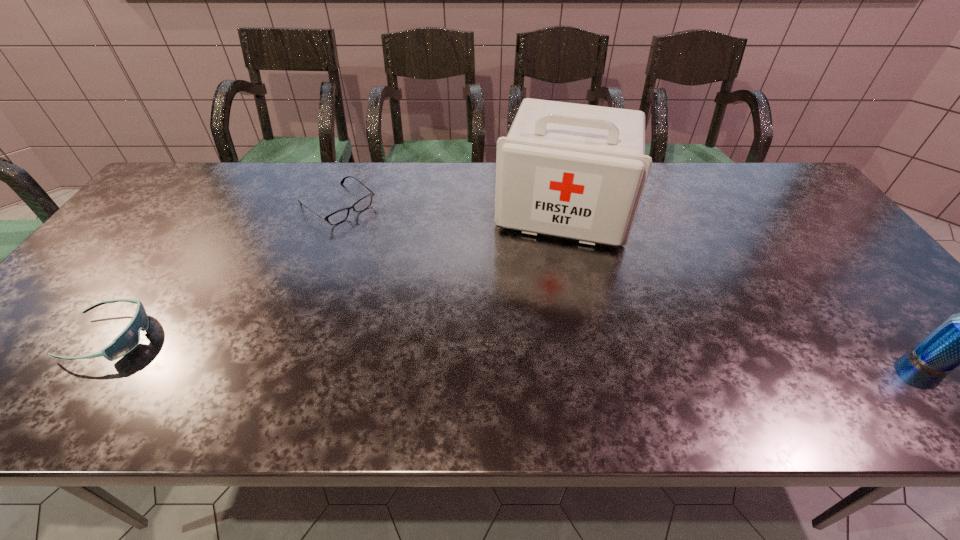
Where is `the closest object to the third object from right to left`? the closest object to the third object from right to left is located at coordinates (577, 171).

The image size is (960, 540). Find the location of `vacant point that satisfies the following two spatial constraints: 1. on the front side of the first-aid kit; 2. on the right side of the spectacles`. vacant point that satisfies the following two spatial constraints: 1. on the front side of the first-aid kit; 2. on the right side of the spectacles is located at coordinates (336, 210).

You are a GUI agent. You are given a task and a screenshot of the screen. Output one action in this format:
    pyautogui.click(x=<x>, y=<y>)
    Task: Click on the free space that satisfies the following two spatial constraints: 1. on the front side of the spectacles; 2. on the left side of the tallest object
    Image resolution: width=960 pixels, height=540 pixels.
    Given the screenshot: What is the action you would take?
    pyautogui.click(x=336, y=210)

Locate an element on the screen. vacant region that satisfies the following two spatial constraints: 1. on the front side of the shortest object; 2. on the right side of the tallest object is located at coordinates pyautogui.click(x=336, y=210).